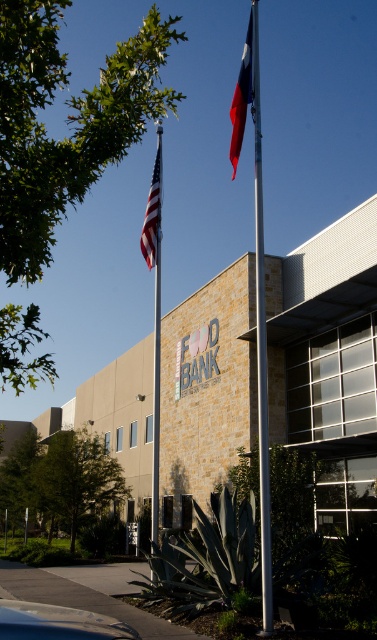
Question: Observing the image, what is the correct spatial positioning of silver metallic flag pole at center in reference to metallic silver car at lower left?

Choices:
 (A) right
 (B) left

Answer: (A)

Question: Which of the following is the closest to the observer?

Choices:
 (A) american flag at upper left
 (B) silver metallic flag pole at center

Answer: (B)

Question: Which point is closer to the camera?

Choices:
 (A) metallic silver car at lower left
 (B) red fabric flag at upper center
 (C) silver metallic flag pole at center
 (D) american flag at upper left

Answer: (A)

Question: Considering the real-world distances, which object is farthest from the metallic silver car at lower left?

Choices:
 (A) american flag at upper left
 (B) red fabric flag at upper center
 (C) silver metallic flag pole at center

Answer: (B)

Question: Is metallic silver car at lower left closer to the viewer compared to american flag at upper left?

Choices:
 (A) yes
 (B) no

Answer: (A)

Question: Can you confirm if silver metallic flag pole at center is bigger than american flag at upper left?

Choices:
 (A) no
 (B) yes

Answer: (B)